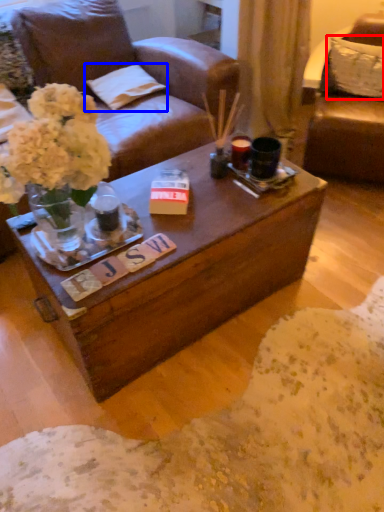
Question: Which object appears closest to the camera in this image, pillow (highlighted by a red box) or pillow (highlighted by a blue box)?

Choices:
 (A) pillow
 (B) pillow

Answer: (A)